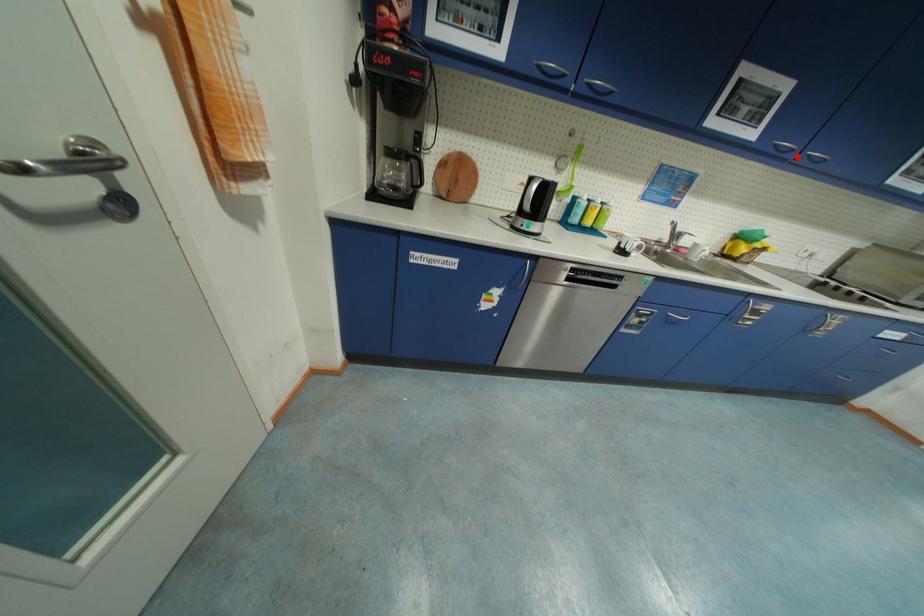
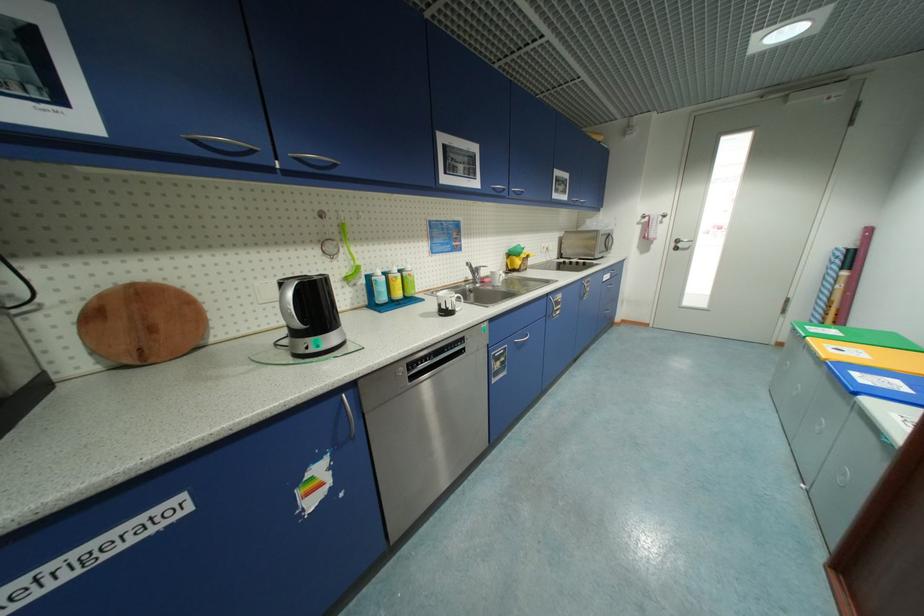
Where in the second image is the point corresponding to the highlighted location from the first image?

(512, 195)